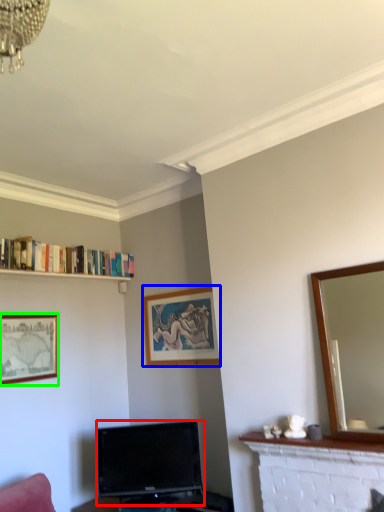
Question: Which object is the farthest from television (highlighted by a red box)? Choose among these: picture frame (highlighted by a blue box) or picture frame (highlighted by a green box).

Choices:
 (A) picture frame
 (B) picture frame

Answer: (B)